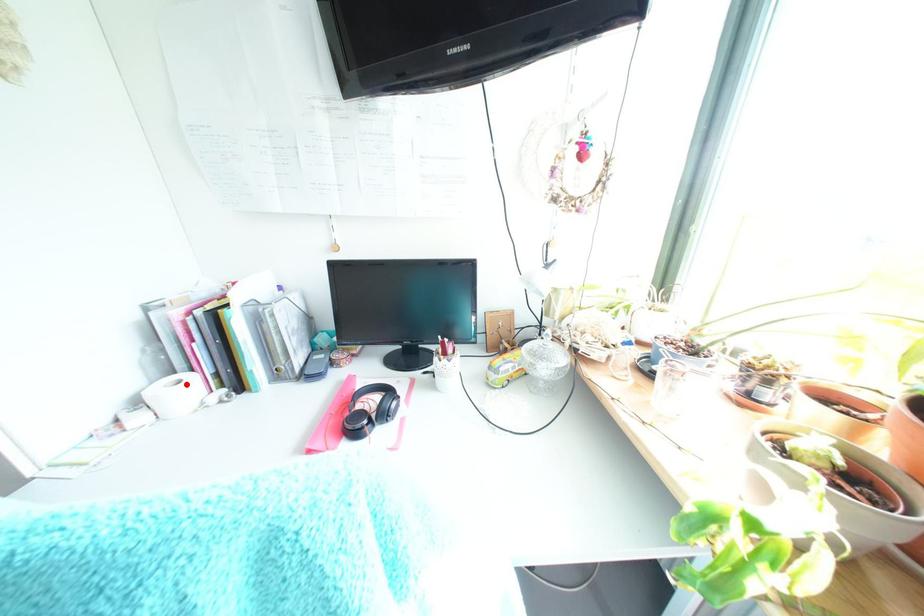
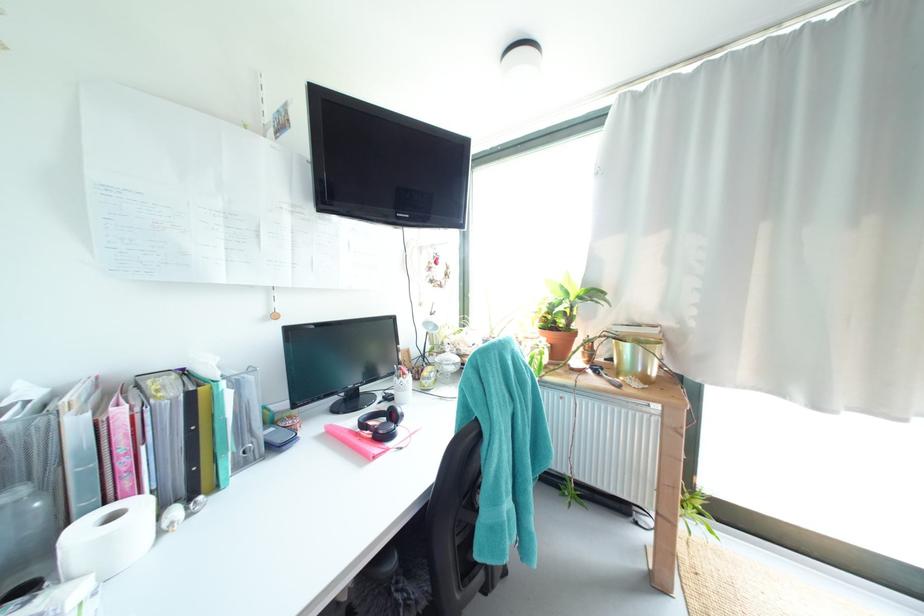
In the second image, find the point that corresponds to the highlighted location in the first image.

(120, 517)